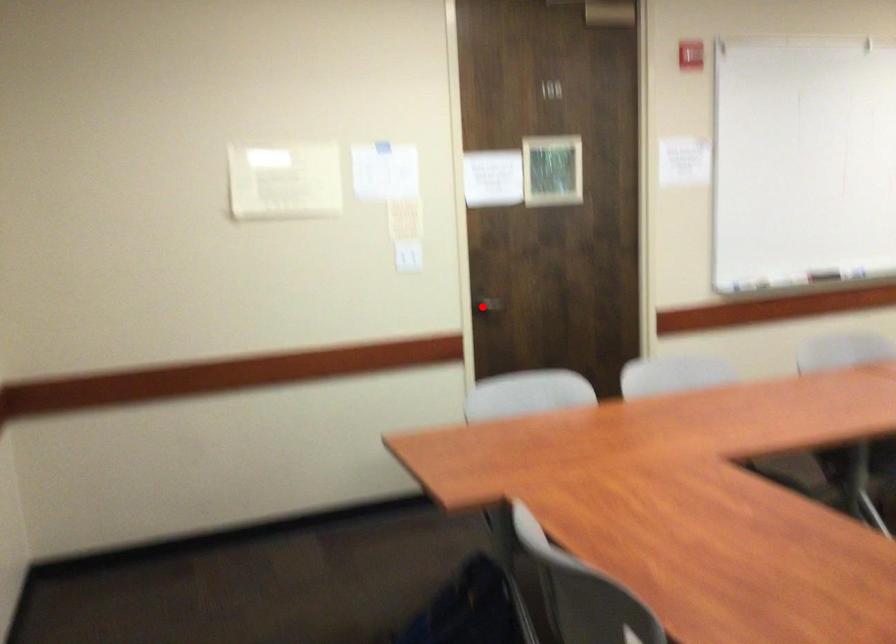
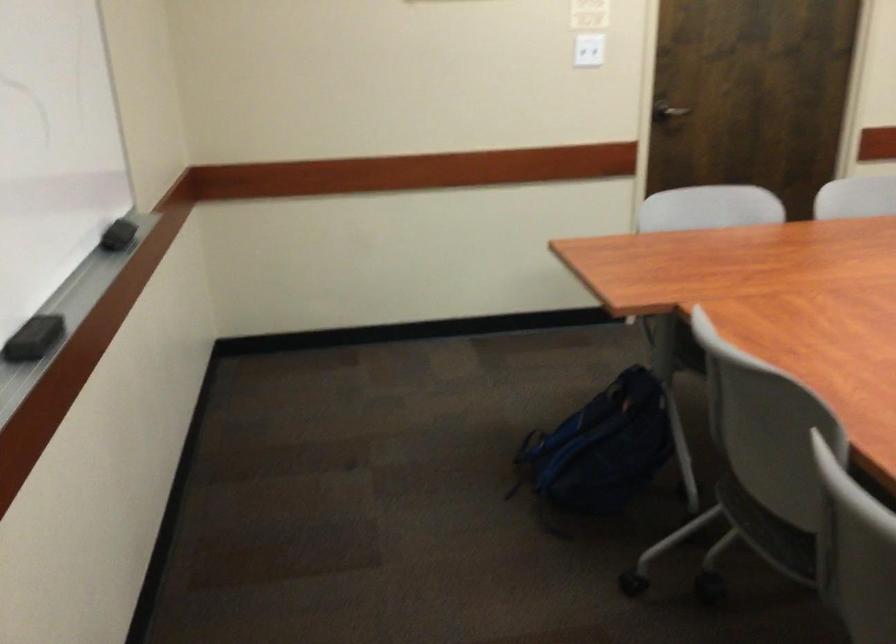
Find the pixel in the second image that matches the highlighted location in the first image.

(667, 111)